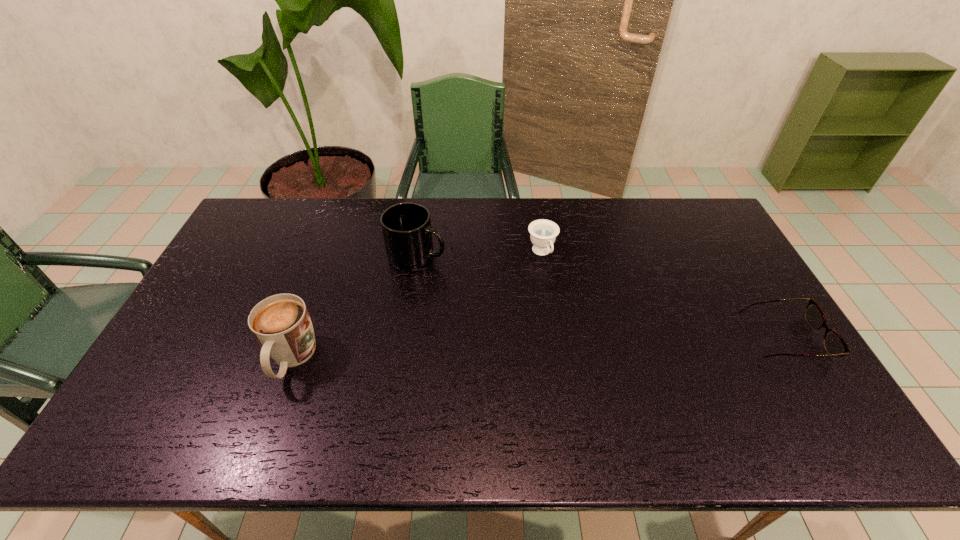
Where is `free space on the desktop that is between the leftmost object and the spectacles and is positioned with the handle on the side of the third object from right to left`? This screenshot has height=540, width=960. free space on the desktop that is between the leftmost object and the spectacles and is positioned with the handle on the side of the third object from right to left is located at coordinates (582, 347).

Locate an element on the screen. vacant spot on the desktop that is between the nearer mug and the rightmost object and is positioned on the side of the second object from right to left with the handle is located at coordinates (595, 346).